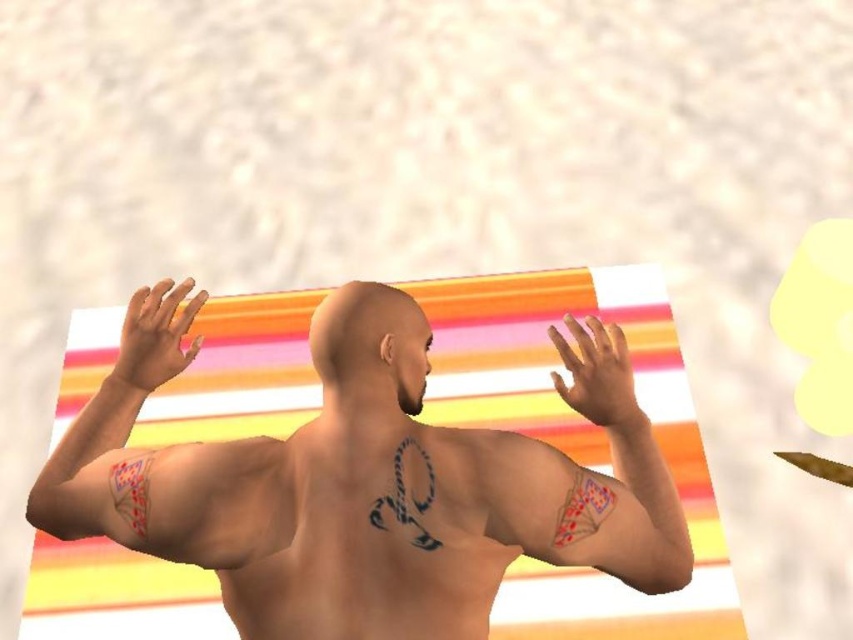
Is smooth skin tattoo at center below smooth skin hand at left?

Correct, smooth skin tattoo at center is located below smooth skin hand at left.

Which is in front, point (621, 481) or point (126, 394)?

Point (621, 481) is more forward.

Between point (611, 522) and point (189, 316), which one is positioned in front?

Point (611, 522)

The image size is (853, 640). What are the coordinates of `smooth skin tattoo at center` in the screenshot? It's located at (590, 477).

Does smooth skin tattoo at left have a smaller size compared to smooth skin hand at left?

No.

Is smooth skin tattoo at left taller than smooth skin hand at left?

Indeed, smooth skin tattoo at left has a greater height compared to smooth skin hand at left.

Is point (82, 528) positioned in front of point (160, 321)?

Yes, it is.

I want to click on smooth skin tattoo at left, so click(114, 406).

Can you confirm if smooth skin tattoo at center is positioned below smooth skin hand at center?

Yes, smooth skin tattoo at center is below smooth skin hand at center.

Is point (508, 492) positioned before point (610, 353)?

Yes, it is.

Is point (607, 388) positioned behind point (590, 321)?

That is False.

Where is `smooth skin tattoo at center`? Image resolution: width=853 pixels, height=640 pixels. smooth skin tattoo at center is located at coordinates (590, 477).